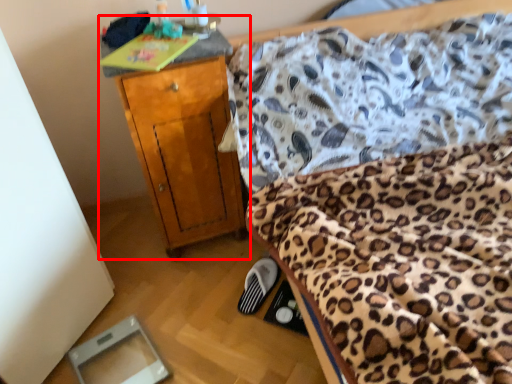
Question: From the image's perspective, where is nightstand (annotated by the red box) located in relation to footwear in the image?

Choices:
 (A) above
 (B) below

Answer: (A)